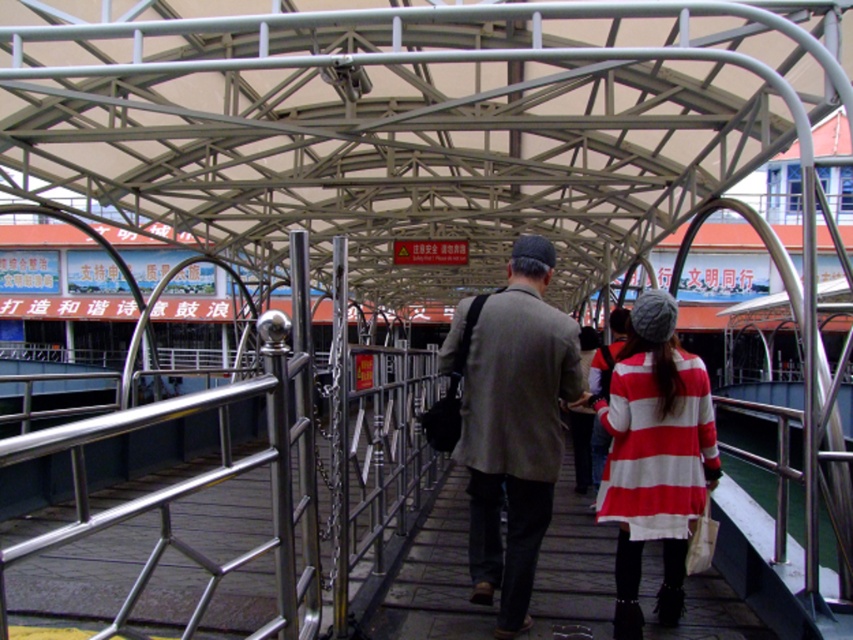
Question: Considering the real-world distances, which object is closest to the gray woolen jacket at center?

Choices:
 (A) white striped dress at center
 (B) striped woolen coat at center

Answer: (B)

Question: Which object is positioned closest to the gray woolen jacket at center?

Choices:
 (A) white striped dress at center
 (B) striped woolen coat at center

Answer: (B)

Question: Is gray woolen jacket at center to the right of striped woolen coat at center from the viewer's perspective?

Choices:
 (A) no
 (B) yes

Answer: (A)

Question: Does gray woolen jacket at center have a lesser width compared to white striped dress at center?

Choices:
 (A) yes
 (B) no

Answer: (A)

Question: Does gray woolen jacket at center have a smaller size compared to white striped dress at center?

Choices:
 (A) no
 (B) yes

Answer: (A)

Question: Which of the following is the farthest from the observer?

Choices:
 (A) (618, 416)
 (B) (445, 356)
 (C) (714, 611)

Answer: (C)